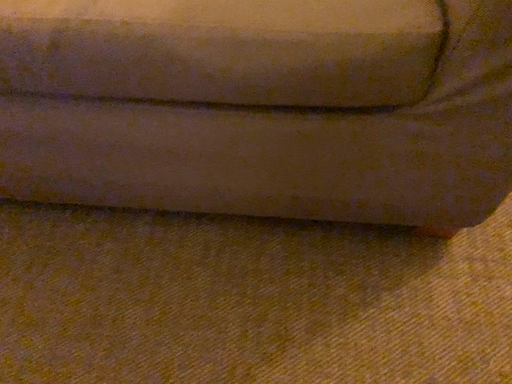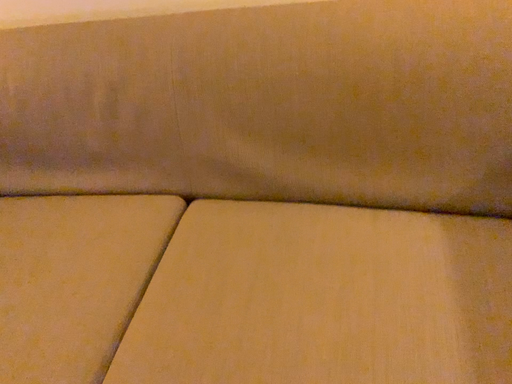
Question: Which way did the camera rotate in the video?

Choices:
 (A) rotated right
 (B) rotated left

Answer: (B)